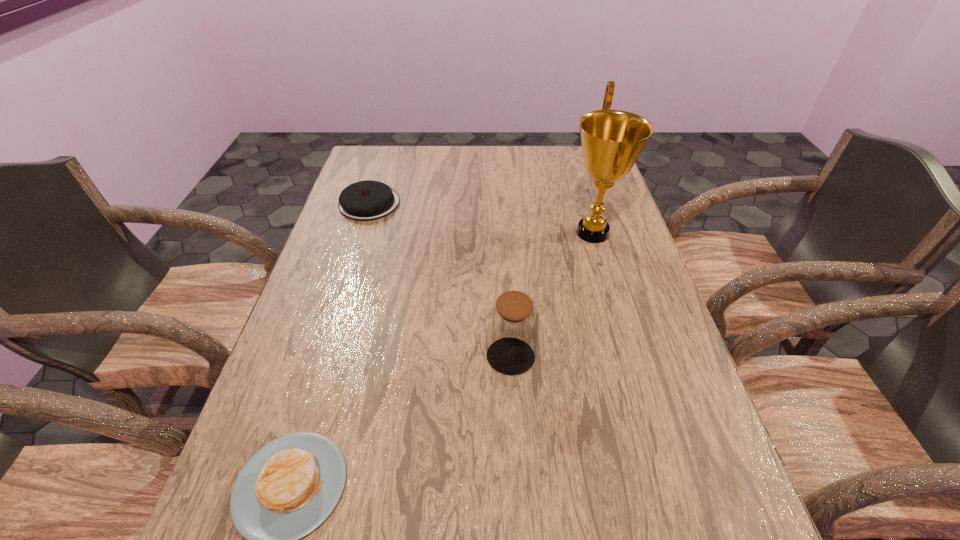
This screenshot has width=960, height=540. Find the location of `the rightmost object`. the rightmost object is located at coordinates (612, 140).

I want to click on the tallest object, so click(612, 140).

The width and height of the screenshot is (960, 540). Find the location of `the third farthest object`. the third farthest object is located at coordinates (512, 330).

I want to click on jar, so click(512, 330).

At what (x,y) coordinates should I click in order to perform the action: click on the farther pancake. Please return your answer as a coordinate pair (x, y). Image resolution: width=960 pixels, height=540 pixels. Looking at the image, I should click on (367, 200).

This screenshot has height=540, width=960. What are the coordinates of `free location located on the front view with handles of the award` in the screenshot? It's located at (444, 233).

Locate an element on the screen. Image resolution: width=960 pixels, height=540 pixels. vacant space located 0.220m on the front view with handles of the award is located at coordinates (486, 233).

Locate an element on the screen. This screenshot has width=960, height=540. free location located 0.170m on the front view with handles of the award is located at coordinates (503, 233).

Locate an element on the screen. vacant space located 0.100m on the front of the jar is located at coordinates (515, 422).

This screenshot has width=960, height=540. What are the coordinates of `blank area located 0.250m on the right of the farther pancake` in the screenshot? It's located at (480, 204).